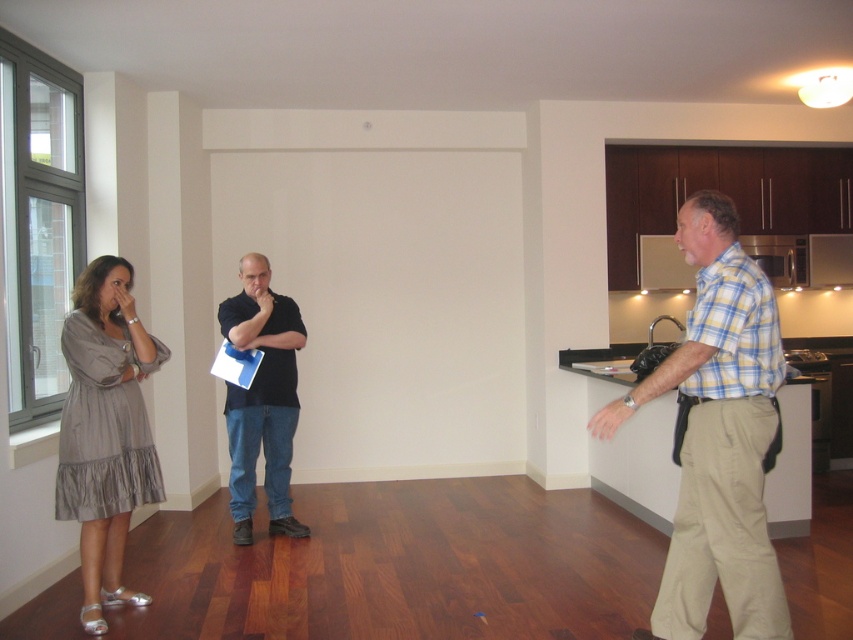
Based on the photo, which is more to the right, silvery-grey dress at left or black matte shirt at center?

black matte shirt at center is more to the right.

Between silvery-grey dress at left and black matte shirt at center, which one has more height?

black matte shirt at center

Who is more forward, (83, 518) or (233, 438)?

Positioned in front is point (83, 518).

Where is `silvery-grey dress at left`? Image resolution: width=853 pixels, height=640 pixels. silvery-grey dress at left is located at coordinates (105, 429).

Between yellow plaid shirt at right and black matte shirt at center, which one is positioned higher?

yellow plaid shirt at right is higher up.

Between yellow plaid shirt at right and black matte shirt at center, which one has less height?

black matte shirt at center is shorter.

Is point (674, 381) less distant than point (267, 349)?

Yes, point (674, 381) is closer to viewer.

Find the location of `yellow plaid shirt at right`. yellow plaid shirt at right is located at coordinates (717, 435).

Is point (137, 417) more distant than point (115, 403)?

That is True.

Which of these two, gray cotton dress at left or silvery-grey dress at left, stands taller?

With more height is silvery-grey dress at left.

Which is behind, point (113, 269) or point (90, 579)?

The point (113, 269) is behind.

Where is `gray cotton dress at left`? The image size is (853, 640). gray cotton dress at left is located at coordinates (105, 429).